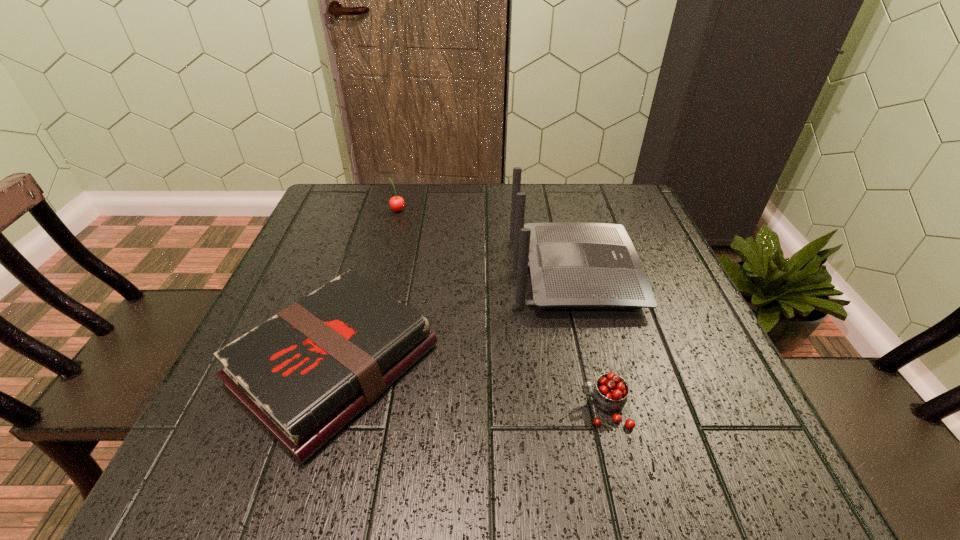
Locate an element on the screen. Image resolution: width=960 pixels, height=540 pixels. object that stands as the second closest to the farthest object is located at coordinates (304, 374).

I want to click on object that ranks as the third closest to the right cherry, so click(397, 203).

Where is `vacant space that satisfies the following two spatial constraints: 1. on the front-facing side of the router; 2. on the front side of the farther cherry`? vacant space that satisfies the following two spatial constraints: 1. on the front-facing side of the router; 2. on the front side of the farther cherry is located at coordinates (558, 210).

Find the location of a particular element. This screenshot has width=960, height=540. free spot that satisfies the following two spatial constraints: 1. on the front side of the hardback book; 2. on the handle side of the nearer cherry is located at coordinates (322, 408).